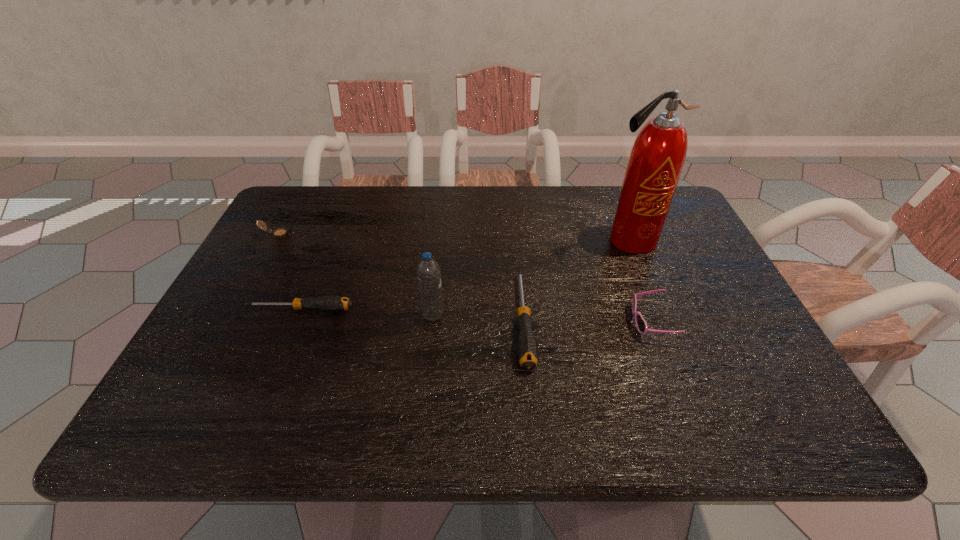
This screenshot has height=540, width=960. In order to click on object that stands as the fifth closest to the taller screwdriver in this screenshot , I will do `click(282, 232)`.

I want to click on blank space that satisfies the following two spatial constraints: 1. on the front side of the shorter screwdriver; 2. on the left side of the fifth shortest object, so click(298, 315).

The height and width of the screenshot is (540, 960). Identify the location of vacant space that satisfies the following two spatial constraints: 1. on the face of the compass; 2. on the left side of the water bottle. (234, 315).

This screenshot has width=960, height=540. In order to click on vacant space that satisfies the following two spatial constraints: 1. on the back side of the right screwdriver; 2. on the face of the compass in this screenshot , I will do `click(515, 234)`.

Identify the location of vacant position in the image that satisfies the following two spatial constraints: 1. on the face of the third object from right to left; 2. on the left side of the compass. This screenshot has height=540, width=960. (231, 320).

At what (x,y) coordinates should I click in order to perform the action: click on vacant space that satisfies the following two spatial constraints: 1. on the back side of the tallest object; 2. on the face of the compass. Please return your answer as a coordinate pair (x, y). This screenshot has height=540, width=960. Looking at the image, I should click on (627, 234).